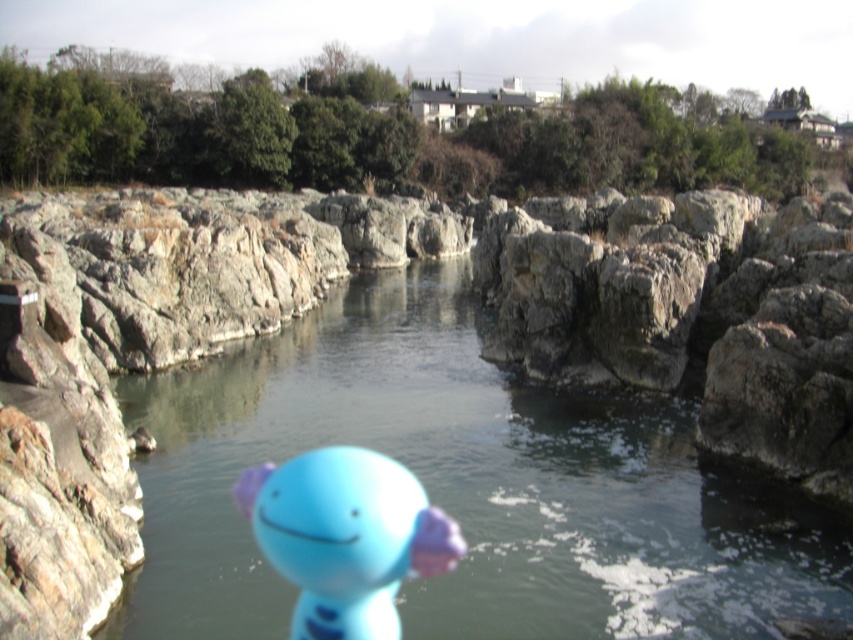
Measure the distance between transparent plastic river at center and matte blue plush toy at center.

transparent plastic river at center is 11.65 feet away from matte blue plush toy at center.

Which is above, transparent plastic river at center or matte blue plush toy at center?

transparent plastic river at center is above.

Which is in front, point (640, 426) or point (292, 637)?

Point (292, 637) is in front.

This screenshot has width=853, height=640. What are the coordinates of `transparent plastic river at center` in the screenshot? It's located at (466, 486).